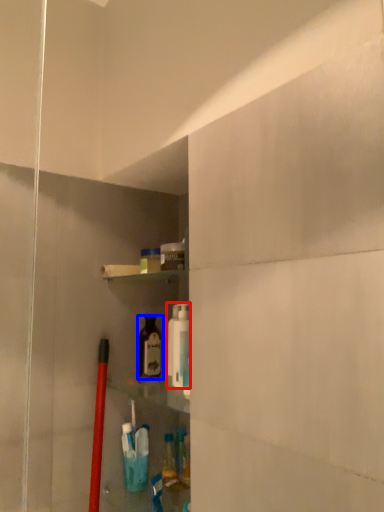
Question: Which object appears closest to the camera in this image, cleaning product (highlighted by a red box) or bottle (highlighted by a blue box)?

Choices:
 (A) cleaning product
 (B) bottle

Answer: (A)